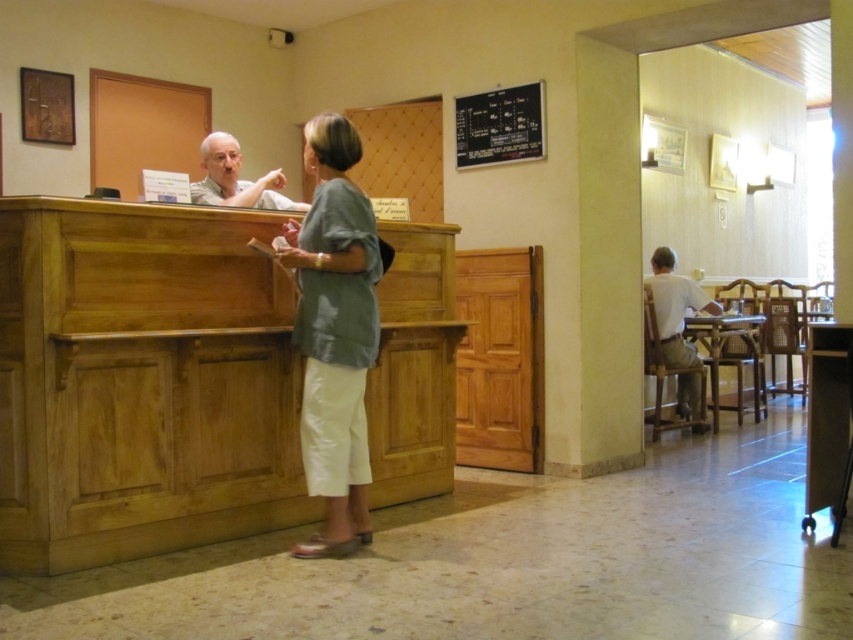
Question: Which of the following is the farthest from the observer?

Choices:
 (A) blackboard at upper center
 (B) matte white shirt at left
 (C) white matte shirt at right
 (D) light green fabric blouse at center

Answer: (C)

Question: Can you confirm if blackboard at upper center is positioned below matte white shirt at left?

Choices:
 (A) yes
 (B) no

Answer: (B)

Question: Which object appears closest to the camera in this image?

Choices:
 (A) matte white shirt at left
 (B) blackboard at upper center
 (C) white matte shirt at right

Answer: (A)

Question: Among these objects, which one is nearest to the camera?

Choices:
 (A) matte white shirt at left
 (B) light green fabric blouse at center
 (C) white matte shirt at right

Answer: (B)

Question: Does light green fabric blouse at center have a smaller size compared to blackboard at upper center?

Choices:
 (A) no
 (B) yes

Answer: (A)

Question: Considering the relative positions of light green fabric blouse at center and blackboard at upper center in the image provided, where is light green fabric blouse at center located with respect to blackboard at upper center?

Choices:
 (A) right
 (B) left

Answer: (B)